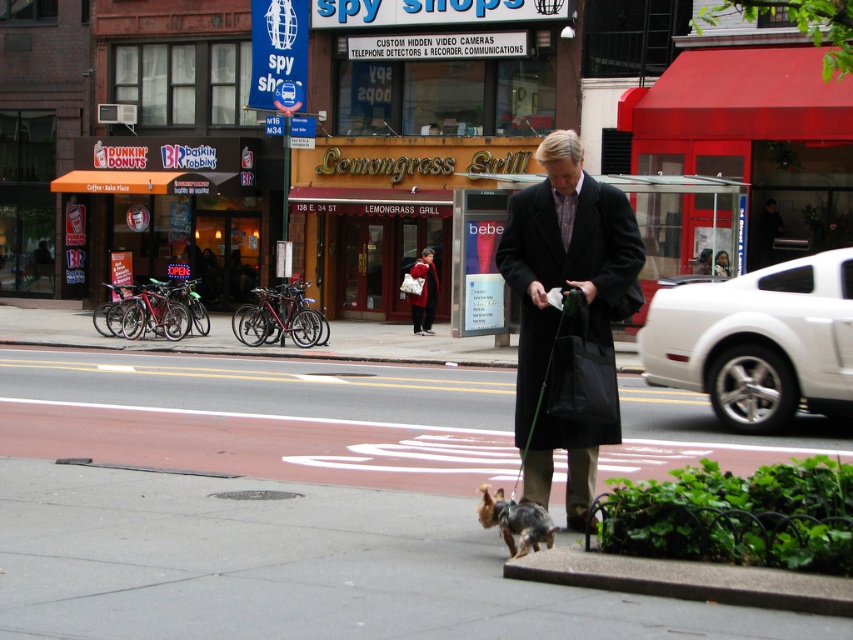
Question: Is smooth asphalt pavement at center closer to camera compared to black wool coat at center?

Choices:
 (A) yes
 (B) no

Answer: (A)

Question: Does shiny brown fur at center lie behind red wool coat at center?

Choices:
 (A) no
 (B) yes

Answer: (A)

Question: Which point appears closest to the camera in this image?

Choices:
 (A) (584, 433)
 (B) (97, 486)
 (C) (503, 538)
 (D) (430, 256)

Answer: (C)

Question: Among these points, which one is nearest to the camera?

Choices:
 (A) (535, 432)
 (B) (413, 300)
 (C) (524, 540)
 (D) (51, 561)

Answer: (C)

Question: Can you confirm if black wool coat at center is wider than red wool coat at center?

Choices:
 (A) no
 (B) yes

Answer: (B)

Question: Which point is farther from the camera taking this photo?

Choices:
 (A) (403, 618)
 (B) (410, 268)

Answer: (B)